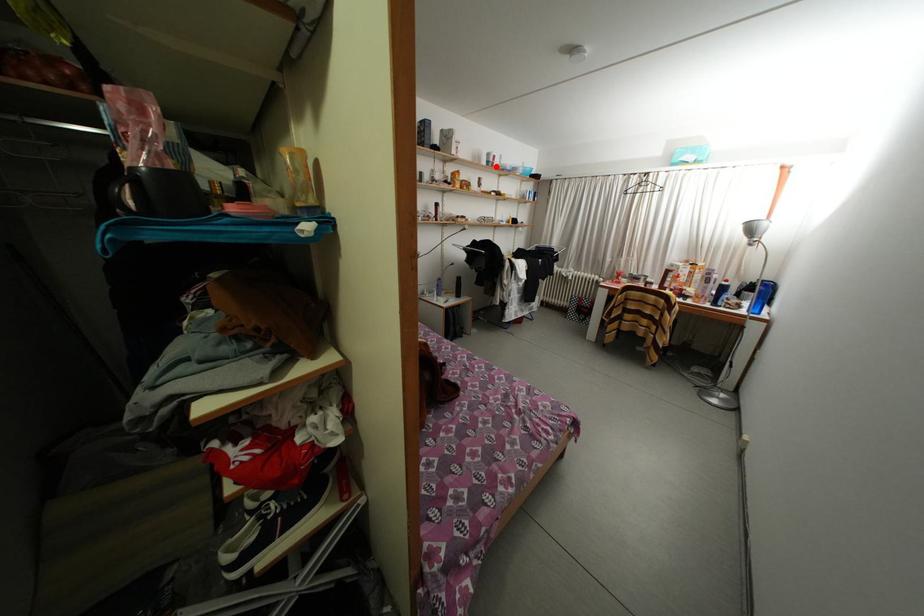
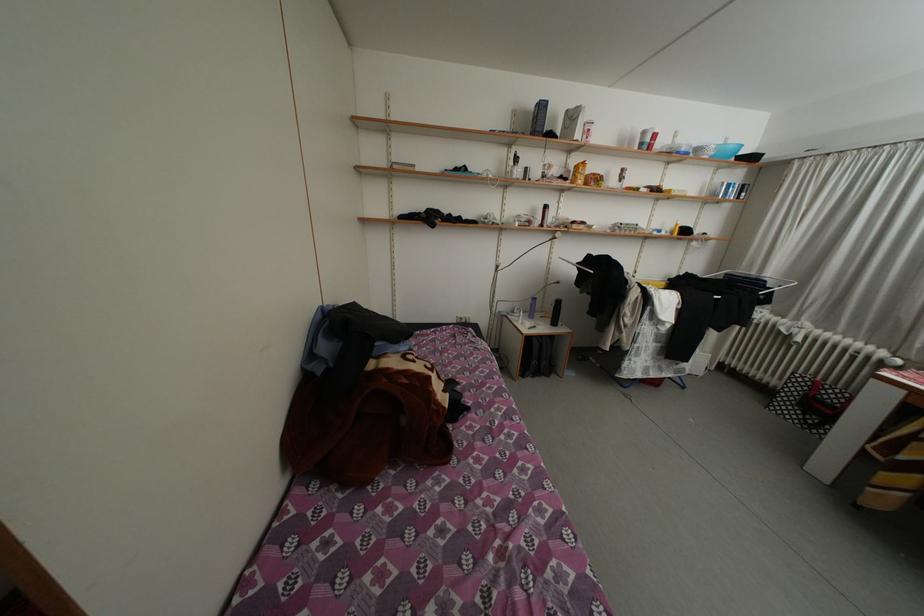
Question: I am providing you with two images of the same scene from different viewpoints. A red point is marked on the first image. At the location where the point appears in image 1, is it still visible in image 2?

Choices:
 (A) Yes
 (B) No

Answer: (A)